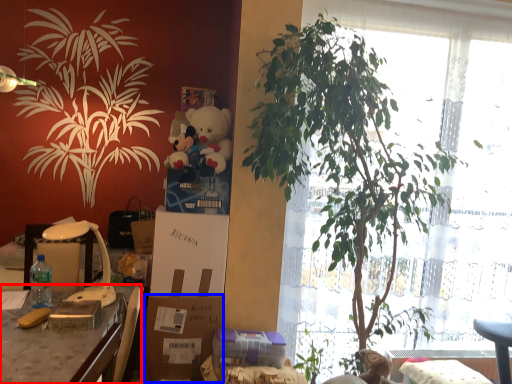
Question: Which object appears closest to the camera in this image, desk (highlighted by a red box) or cardboard box (highlighted by a blue box)?

Choices:
 (A) desk
 (B) cardboard box

Answer: (A)